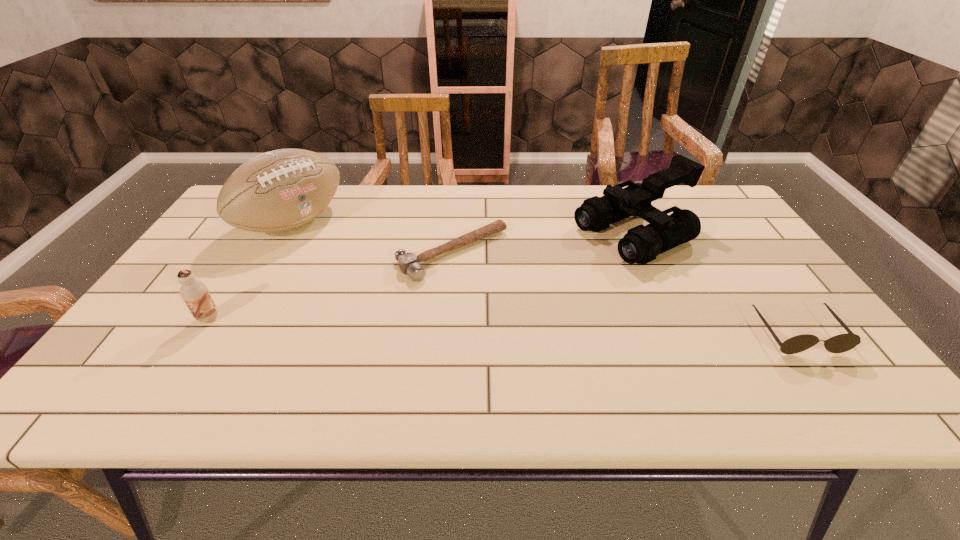
This screenshot has width=960, height=540. In order to click on vacant area in the image that satisfies the following two spatial constraints: 1. on the front side of the fourth shortest object; 2. on the right side of the football (American) in this screenshot , I will do `click(286, 234)`.